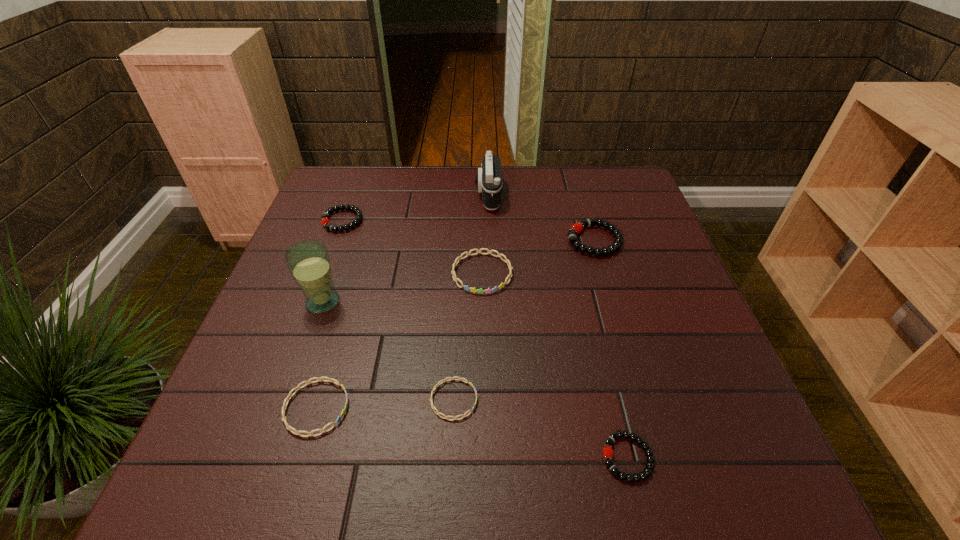
Locate an element on the screen. Image resolution: width=960 pixels, height=540 pixels. camera located in the far edge section of the desktop is located at coordinates (489, 177).

You are a GUI agent. You are given a task and a screenshot of the screen. Output one action in this format:
    pyautogui.click(x=<x>, y=<y>)
    Task: Click on the bracelet located at the far edge
    
    Given the screenshot: What is the action you would take?
    pyautogui.click(x=325, y=221)

Image resolution: width=960 pixels, height=540 pixels. What are the coordinates of `object that is at the near edge` in the screenshot? It's located at (607, 451).

I want to click on glass that is at the left edge, so coord(308,261).

This screenshot has width=960, height=540. What are the coordinates of `object that is at the right edge` in the screenshot? It's located at (577, 227).

Find the location of a particular element. object that is at the far left corner is located at coordinates (325, 221).

What are the coordinates of `vacant region at the far edge of the desktop` in the screenshot? It's located at (567, 178).

Locate an element on the screen. Image resolution: width=960 pixels, height=540 pixels. blank space at the left edge of the desktop is located at coordinates (263, 333).

Where is `vacant area at the right edge of the desktop`? This screenshot has width=960, height=540. vacant area at the right edge of the desktop is located at coordinates (649, 361).

The height and width of the screenshot is (540, 960). I want to click on vacant space at the far left corner, so click(360, 199).